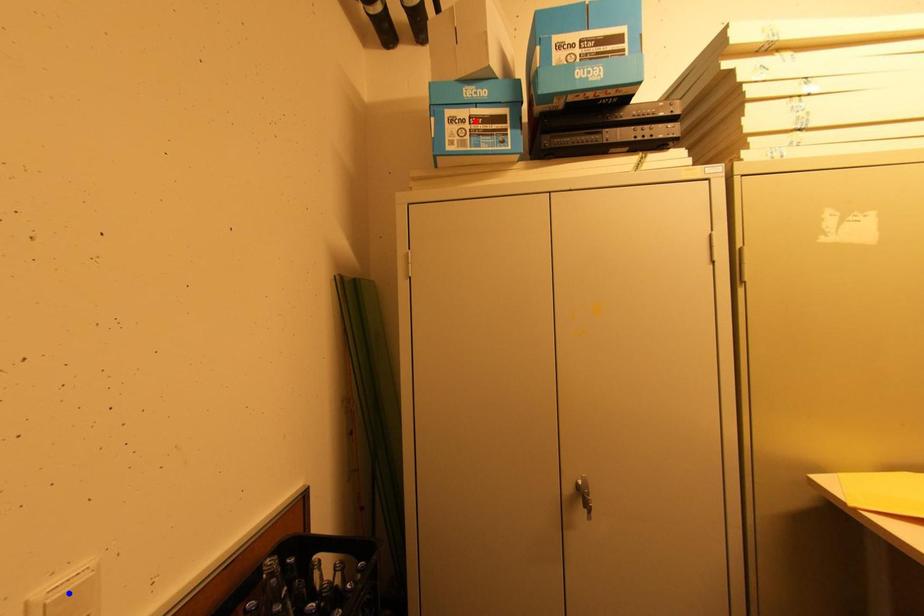
Question: Two points are marked on the image. Which point is closer to the camera?

Choices:
 (A) Blue point is closer.
 (B) Red point is closer.

Answer: (A)